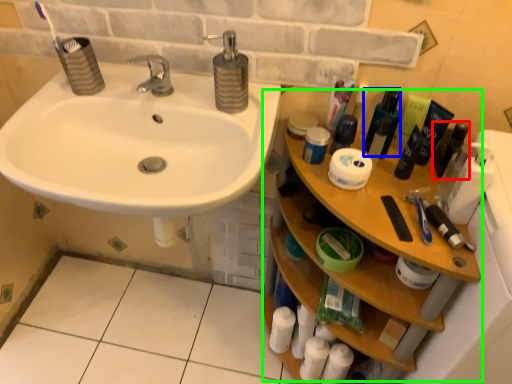
Question: Which object is the closest to the mouthwash (highlighted by a red box)? Choose among these: mouthwash (highlighted by a blue box) or counter (highlighted by a green box).

Choices:
 (A) mouthwash
 (B) counter

Answer: (A)